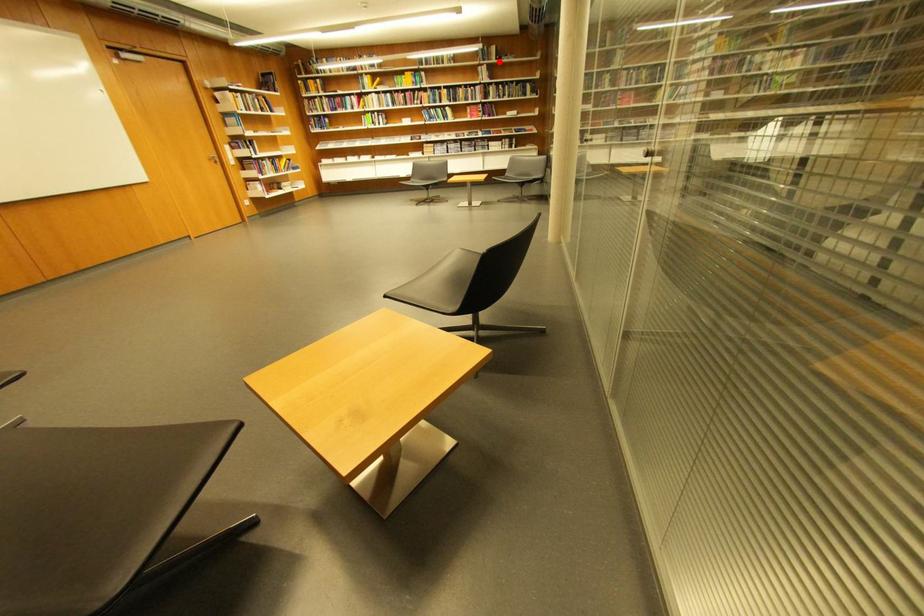
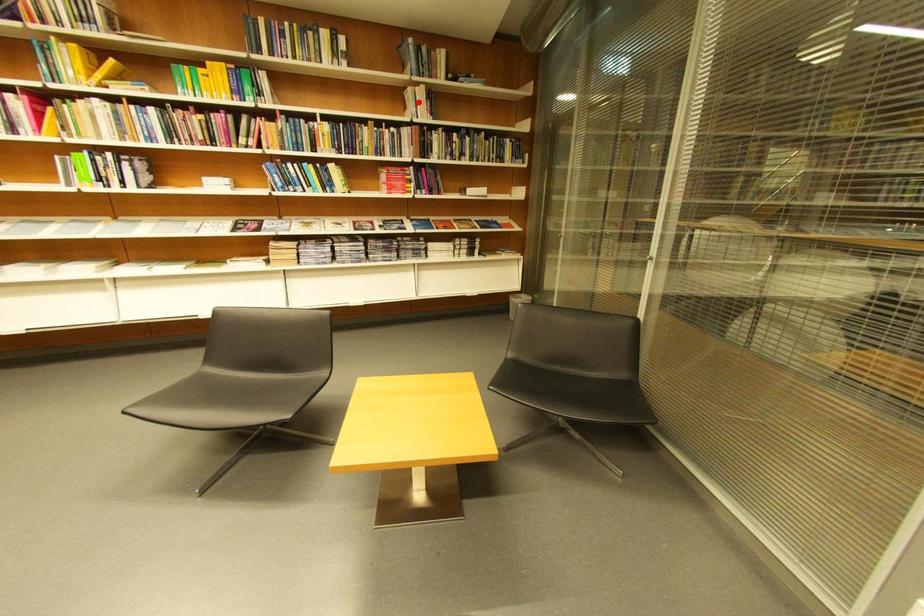
Consider the image. I am providing you with two images of the same scene from different viewpoints. A red point is marked on the first image and another point is marked on the second image. Are the points marked in image1 and image2 representing the same 3D position?

No